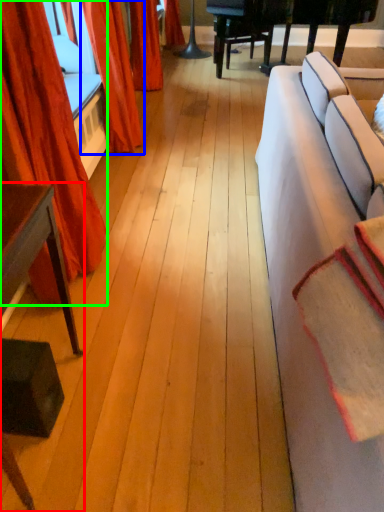
Question: Which object is positioned farthest from table (highlighted by a red box)? Select from curtain (highlighted by a blue box) and curtain (highlighted by a green box).

Choices:
 (A) curtain
 (B) curtain

Answer: (A)